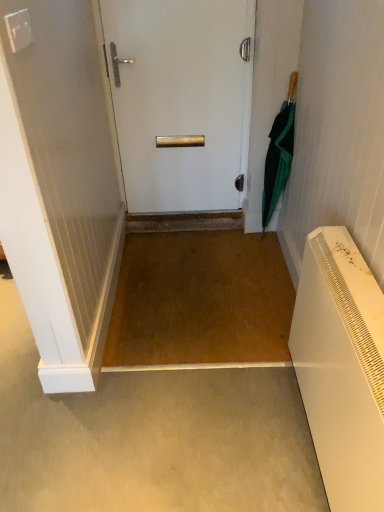
Locate an element on the screen. The height and width of the screenshot is (512, 384). unoccupied area in front of green fabric umbrella at right is located at coordinates (263, 253).